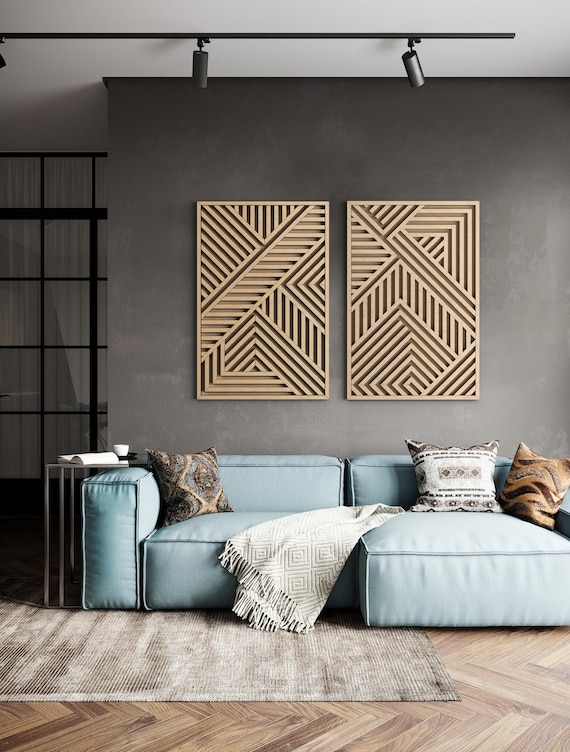
The height and width of the screenshot is (752, 570). I want to click on sofa pillows, so pyautogui.click(x=458, y=472), pyautogui.click(x=526, y=484), pyautogui.click(x=191, y=475).